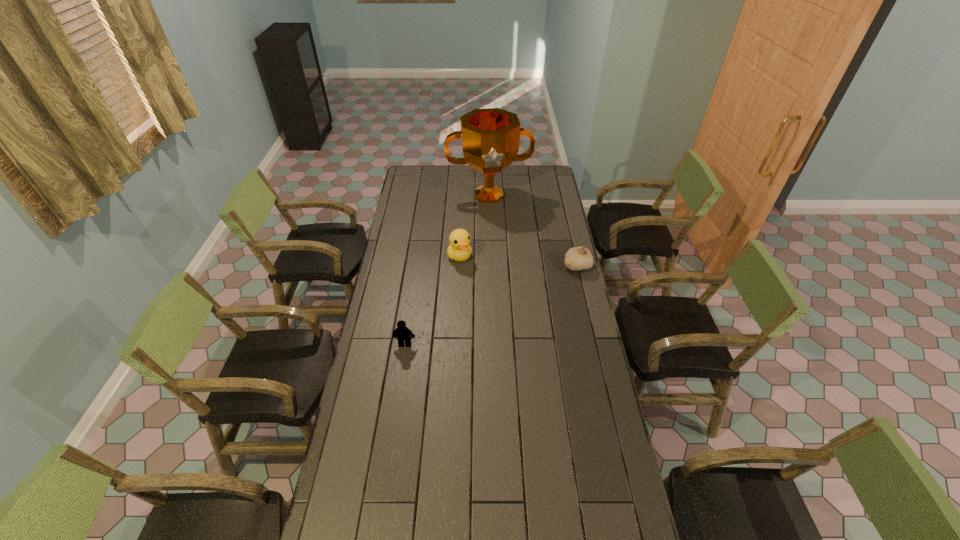
Identify the location of the nearest object. (401, 333).

This screenshot has width=960, height=540. I want to click on the leftmost object, so click(401, 333).

Find the location of a particular element. Image resolution: width=960 pixels, height=540 pixels. the rightmost object is located at coordinates (577, 258).

At what (x,y) coordinates should I click in order to perform the action: click on award. Please return your answer as a coordinate pair (x, y). Looking at the image, I should click on (490, 137).

At what (x,y) coordinates should I click in order to perform the action: click on the farthest object. Please return your answer as a coordinate pair (x, y). Looking at the image, I should click on (490, 137).

Find the location of `duck`. duck is located at coordinates (459, 249).

Find the location of a particular element. vacant region located 0.180m on the face of the leftmost object is located at coordinates (398, 387).

Locate an element on the screen. This screenshot has height=540, width=960. free spot located on the back of the rightmost object is located at coordinates (564, 212).

Find the location of a particular element. Image resolution: width=960 pixels, height=540 pixels. free region located 0.080m on the side of the tallest object with the star emblem is located at coordinates (496, 220).

In order to click on free space located 0.190m on the side of the tallest object with the star emblem in this screenshot , I will do `click(498, 232)`.